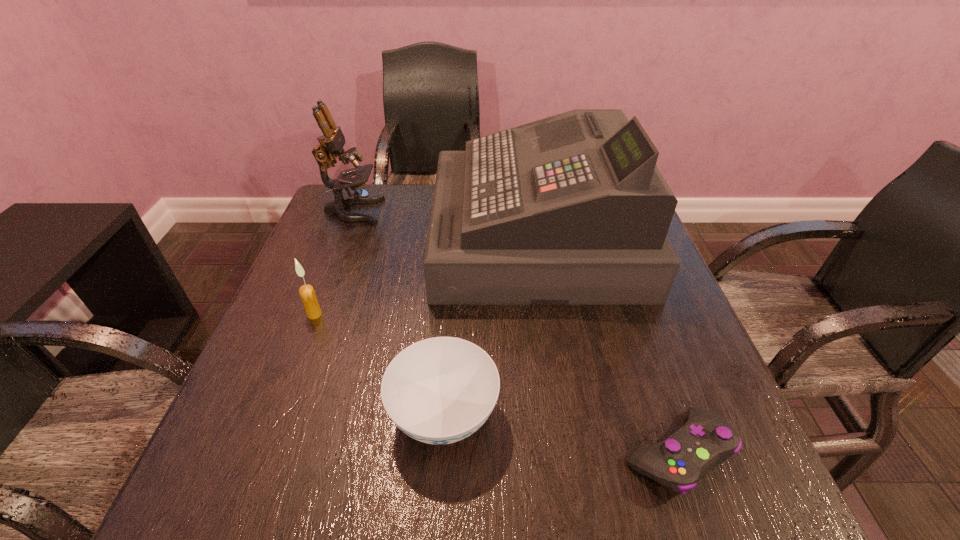
You are a GUI agent. You are given a task and a screenshot of the screen. Output one action in this format:
    pyautogui.click(x=<x>, y=<y>)
    Task: Click on the vacant space positioned on the back of the third nearest object
    
    Given the screenshot: What is the action you would take?
    pyautogui.click(x=326, y=284)

Find the location of a particular element. This screenshot has height=540, width=960. vacant space positioned on the right of the chinaware is located at coordinates (540, 415).

Find the location of a particular element. Image resolution: width=960 pixels, height=540 pixels. vacant space located 0.400m on the left of the control is located at coordinates (x=372, y=453).

Find the location of a particular element. The height and width of the screenshot is (540, 960). cash register that is at the far edge is located at coordinates (571, 209).

In order to click on microscope present at the far edge in this screenshot , I will do `click(332, 141)`.

I want to click on chinaware located in the near edge section of the desktop, so click(440, 390).

Where is `control at the near edge`? This screenshot has height=540, width=960. control at the near edge is located at coordinates [x=705, y=441].

The image size is (960, 540). What are the coordinates of `microscope that is at the left edge` in the screenshot? It's located at (332, 141).

At what (x,y) coordinates should I click in order to perform the action: click on candle located at the left edge. Please return your answer as a coordinate pair (x, y). Looking at the image, I should click on click(307, 293).

You are a GUI agent. You are given a task and a screenshot of the screen. Output one action in this format:
    pyautogui.click(x=<x>, y=<y>)
    Task: Click on the cash register positioned at the right edge
    
    Given the screenshot: What is the action you would take?
    pyautogui.click(x=571, y=209)